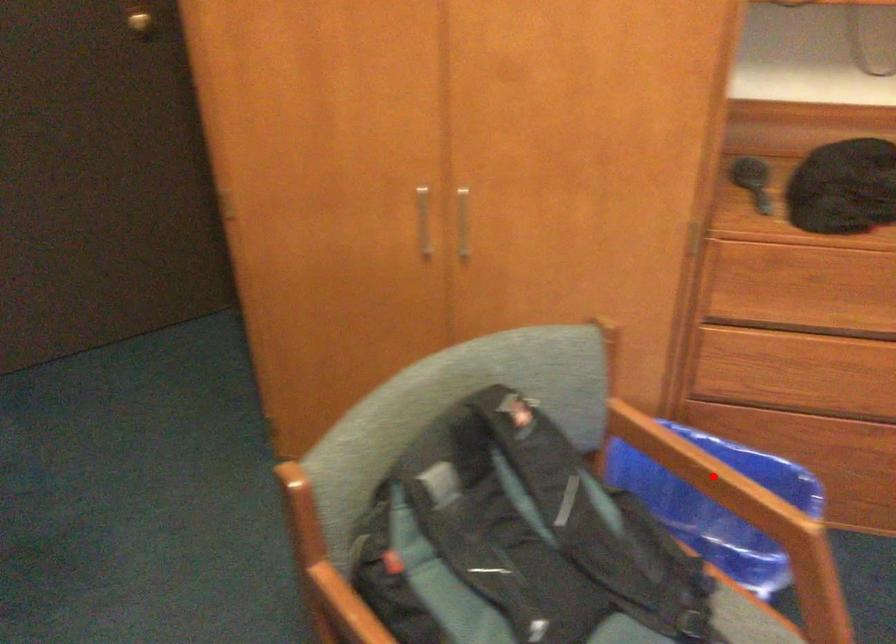
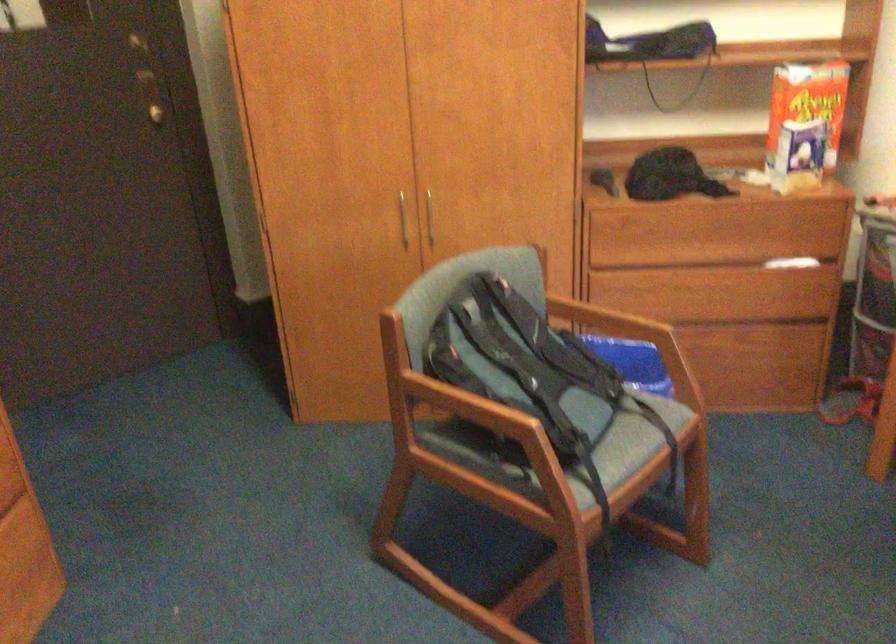
In the second image, find the point that corresponds to the highlighted location in the first image.

(609, 325)